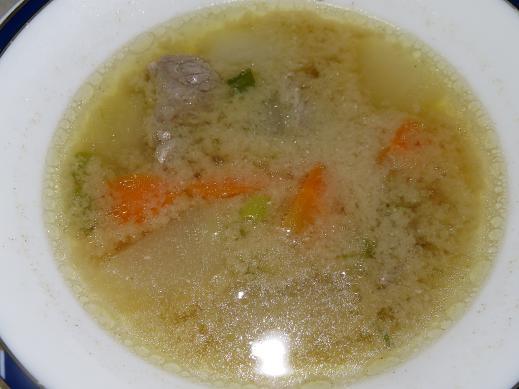
Find the location of `inside of bowl`. inside of bowl is located at coordinates (45, 320).